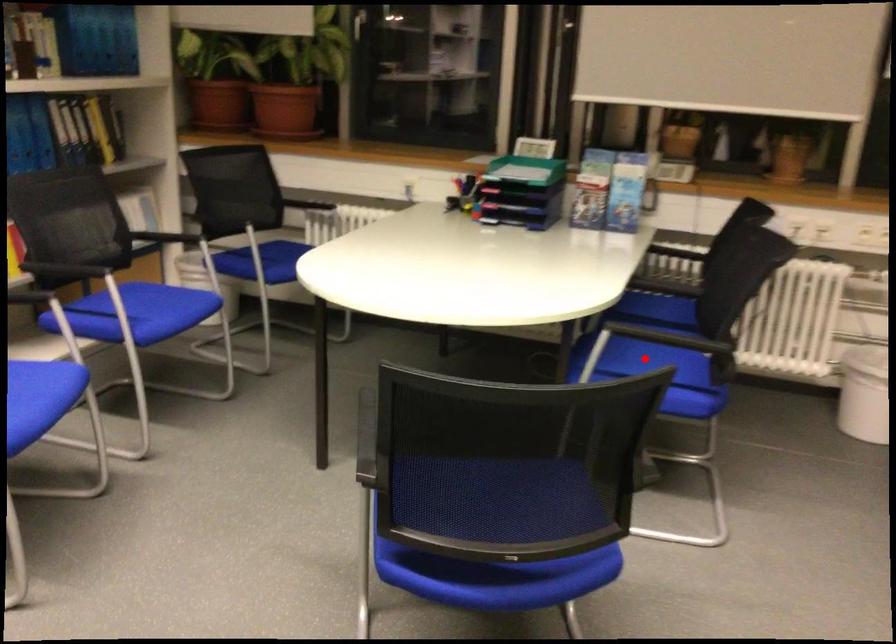
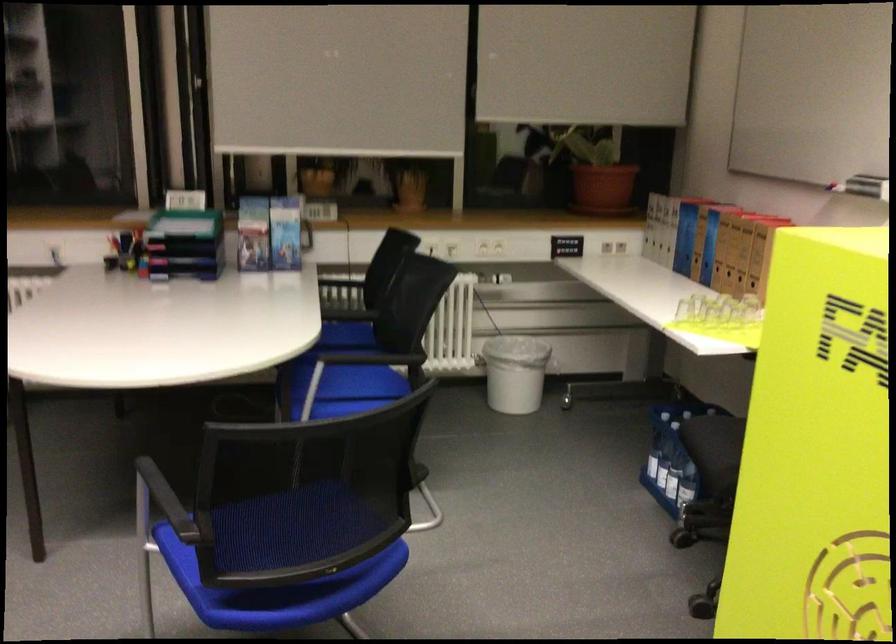
The point at the highlighted location is marked in the first image. Where is the corresponding point in the second image?

(349, 382)